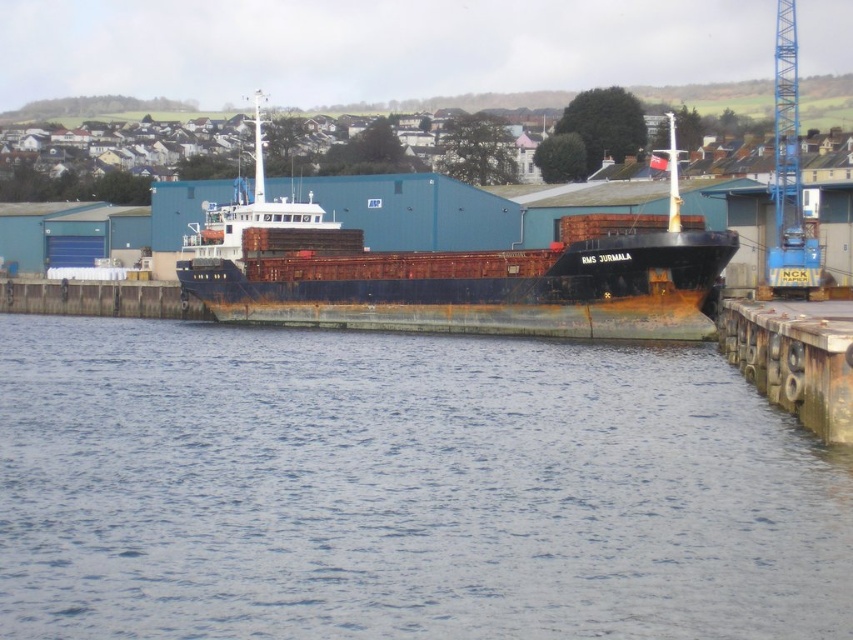
You are standing on the pier and want to know the exact location of the blue water at lower center. According to the coordinates provided, where is it positioned?

The blue water at lower center is located at point coordinates [402,490].

You are standing on the pier and see the rusty metal ship at center and the blue metallic crane at upper right. Which object is positioned to the left when facing the water?

The rusty metal ship at center is to the left of the blue metallic crane at upper right when facing the water.